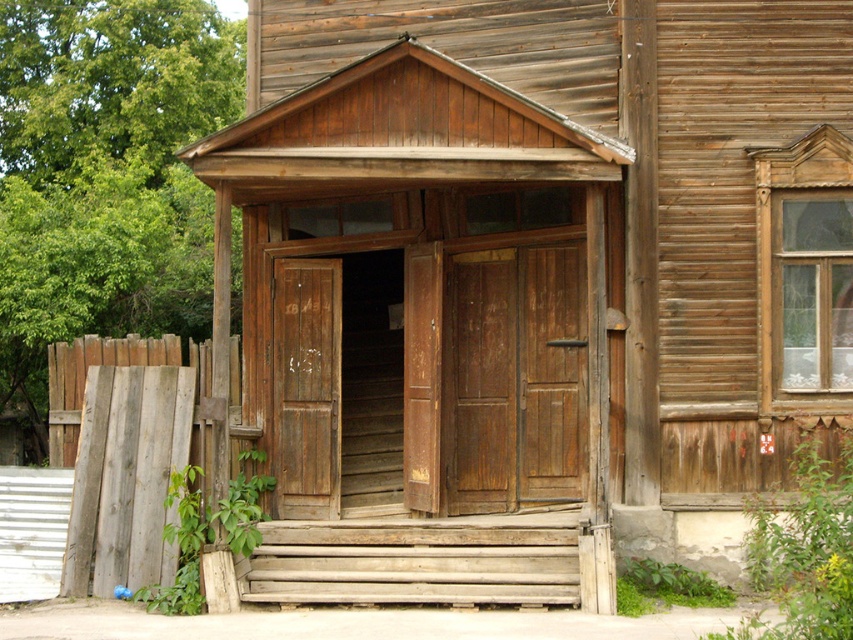
Question: Can you confirm if dark brown wooden door at center is positioned to the left of weathered wood stairs at center?

Choices:
 (A) yes
 (B) no

Answer: (B)

Question: Is weathered wood stairs at center smaller than weathered wood door at center?

Choices:
 (A) no
 (B) yes

Answer: (A)

Question: Which of these objects is positioned farthest from the weathered wood stairs at center?

Choices:
 (A) weathered wood planks at left
 (B) weathered wood fence at lower left

Answer: (B)

Question: In this image, where is weathered wood planks at left located relative to weathered wood door at center?

Choices:
 (A) right
 (B) left

Answer: (B)

Question: Which object appears farthest from the camera in this image?

Choices:
 (A) weathered wood fence at lower left
 (B) weathered wood door at center
 (C) weathered wood stairs at center
 (D) dark brown wooden door at center

Answer: (B)

Question: Which object appears closest to the camera in this image?

Choices:
 (A) weathered wood planks at left
 (B) weathered wood stairs at center
 (C) weathered wood fence at lower left

Answer: (B)